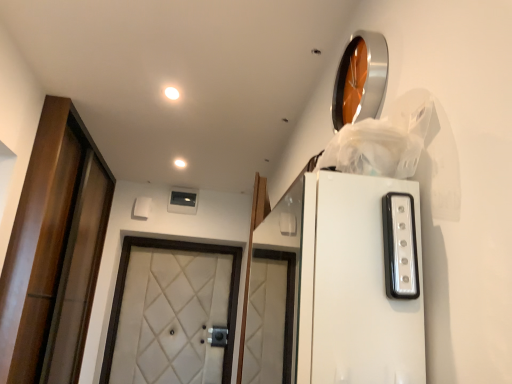
What do you see at coordinates (54, 250) in the screenshot? This screenshot has width=512, height=384. I see `brown wooden door at left, which ranks as the second door in right-to-left order` at bounding box center [54, 250].

What is the approximate width of brown wooden door at left, which ranks as the second door in right-to-left order?

brown wooden door at left, which ranks as the second door in right-to-left order, is 4.55 inches in width.

What do you see at coordinates (180, 163) in the screenshot?
I see `white matte light fixture at upper center, positioned as the second lighting in top-to-bottom order` at bounding box center [180, 163].

At what (x,y) coordinates should I click in order to perform the action: click on white glossy light strip at upper right. Please return your answer as a coordinate pair (x, y). Looking at the image, I should click on (400, 246).

Locate an element on the screen. brown wooden door at left, marked as the 1th door in a left-to-right arrangement is located at coordinates (54, 250).

Between matte white light fixture at upper center, which is the 1th lighting from front to back, and white glossy light strip at upper right, which one appears on the right side from the viewer's perspective?

white glossy light strip at upper right is more to the right.

Which is more distant, (169,92) or (408,278)?

Point (169,92)

Which is behind, matte white light fixture at upper center, the second lighting when ordered from bottom to top, or white glossy light strip at upper right?

matte white light fixture at upper center, the second lighting when ordered from bottom to top, is more distant.

Is white quilted fabric door at center, acting as the second door starting from the left, shorter than matte white light fixture at upper center, marked as the 1th lighting in a right-to-left arrangement?

Incorrect, the height of white quilted fabric door at center, acting as the second door starting from the left, does not fall short of that of matte white light fixture at upper center, marked as the 1th lighting in a right-to-left arrangement.

Can you confirm if white quilted fabric door at center, the first door when ordered from right to left, is positioned to the left of matte white light fixture at upper center, which is the 1th lighting from front to back?

Yes, white quilted fabric door at center, the first door when ordered from right to left, is to the left of matte white light fixture at upper center, which is the 1th lighting from front to back.

Considering the points (231, 310) and (169, 93), which point is in front, point (231, 310) or point (169, 93)?

The point (169, 93) is closer to the camera.

Considering the relative positions of brown wooden door at left, which ranks as the second door in right-to-left order, and white quilted fabric door at center, the first door when ordered from right to left, in the image provided, is brown wooden door at left, which ranks as the second door in right-to-left order, to the right of white quilted fabric door at center, the first door when ordered from right to left, from the viewer's perspective?

Incorrect, brown wooden door at left, which ranks as the second door in right-to-left order, is not on the right side of white quilted fabric door at center, the first door when ordered from right to left.

Which is closer to the camera, (89, 214) or (127, 241)?

The point (89, 214) is in front.

Is the surface of brown wooden door at left, which ranks as the second door in right-to-left order, in direct contact with white quilted fabric door at center, the first door when ordered from right to left?

No, brown wooden door at left, which ranks as the second door in right-to-left order, is not making contact with white quilted fabric door at center, the first door when ordered from right to left.

Can you confirm if brown wooden door at left, marked as the 1th door in a left-to-right arrangement, is bigger than white quilted fabric door at center, the first door when ordered from right to left?

Yes.

Would you say white matte light fixture at upper center, marked as the second lighting in a front-to-back arrangement, contains white glossy light strip at upper right?

No, white glossy light strip at upper right is not surrounded by white matte light fixture at upper center, marked as the second lighting in a front-to-back arrangement.

Measure the distance between white matte light fixture at upper center, the 1th lighting positioned from the bottom, and white glossy light strip at upper right.

A distance of 1.90 meters exists between white matte light fixture at upper center, the 1th lighting positioned from the bottom, and white glossy light strip at upper right.

Between point (181, 161) and point (386, 198), which one is positioned behind?

Point (181, 161)

Could you measure the distance between matte white light fixture at upper center, marked as the 1th lighting in a right-to-left arrangement, and white quilted fabric door at center, the first door when ordered from right to left?

The distance of matte white light fixture at upper center, marked as the 1th lighting in a right-to-left arrangement, from white quilted fabric door at center, the first door when ordered from right to left, is 5.34 feet.

This screenshot has width=512, height=384. What are the coordinates of `the 2nd lighting above when counting from the white quilted fabric door at center, the first door when ordered from right to left (from the image's perspective)` in the screenshot? It's located at (172, 93).

Looking at this image, which is behind, matte white light fixture at upper center, which appears as the second lighting when viewed from the left, or white quilted fabric door at center, the first door when ordered from right to left?

white quilted fabric door at center, the first door when ordered from right to left.

Visually, is matte white light fixture at upper center, acting as the first lighting starting from the top, positioned to the left or to the right of white quilted fabric door at center, acting as the second door starting from the left?

Based on their positions, matte white light fixture at upper center, acting as the first lighting starting from the top, is located to the right of white quilted fabric door at center, acting as the second door starting from the left.

Where is `the 2nd door directly beneath the white matte light fixture at upper center, positioned as the second lighting in top-to-bottom order (from a real-world perspective)`? The height and width of the screenshot is (384, 512). the 2nd door directly beneath the white matte light fixture at upper center, positioned as the second lighting in top-to-bottom order (from a real-world perspective) is located at coordinates (170, 249).

Is white matte light fixture at upper center, the first lighting from the back, facing towards white quilted fabric door at center, acting as the second door starting from the left?

No, white matte light fixture at upper center, the first lighting from the back, does not turn towards white quilted fabric door at center, acting as the second door starting from the left.

Looking at this image, which is more to the right, white matte light fixture at upper center, the 1th lighting positioned from the bottom, or white quilted fabric door at center, acting as the second door starting from the left?

Positioned to the right is white matte light fixture at upper center, the 1th lighting positioned from the bottom.

Considering the relative sizes of white matte light fixture at upper center, positioned as the second lighting in top-to-bottom order, and white quilted fabric door at center, the first door when ordered from right to left, in the image provided, is white matte light fixture at upper center, positioned as the second lighting in top-to-bottom order, wider than white quilted fabric door at center, the first door when ordered from right to left,?

No.

Would you say white glossy light strip at upper right is part of brown wooden door at left, which ranks as the second door in right-to-left order,'s contents?

No.

Is brown wooden door at left, marked as the 1th door in a left-to-right arrangement, oriented towards white glossy light strip at upper right?

No, brown wooden door at left, marked as the 1th door in a left-to-right arrangement, is not turned towards white glossy light strip at upper right.

Considering the positions of point (31, 362) and point (388, 263), is point (31, 362) closer or farther from the camera than point (388, 263)?

Point (31, 362) is farther from the camera than point (388, 263).

Based on the photo, considering the relative sizes of brown wooden door at left, which ranks as the second door in right-to-left order, and white glossy light strip at upper right in the image provided, is brown wooden door at left, which ranks as the second door in right-to-left order, bigger than white glossy light strip at upper right?

Indeed, brown wooden door at left, which ranks as the second door in right-to-left order, has a larger size compared to white glossy light strip at upper right.

The width and height of the screenshot is (512, 384). Find the location of `appliance in front of the matte white light fixture at upper center, the 2th lighting viewed from the back`. appliance in front of the matte white light fixture at upper center, the 2th lighting viewed from the back is located at coordinates (400, 246).

From the image's perspective, which door is the 2nd one below the matte white light fixture at upper center, the 2th lighting viewed from the back? Please provide its 2D coordinates.

[(170, 249)]

Which object lies further to the anchor point white glossy light strip at upper right, white matte light fixture at upper center, which is the 1th lighting from left to right, or white quilted fabric door at center, acting as the second door starting from the left?

Among the two, white quilted fabric door at center, acting as the second door starting from the left, is located further to white glossy light strip at upper right.

Estimate the real-world distances between objects in this image. Which object is closer to white glossy light strip at upper right, white matte light fixture at upper center, acting as the 2th lighting starting from the right, or matte white light fixture at upper center, which is the 1th lighting from front to back?

The object closer to white glossy light strip at upper right is matte white light fixture at upper center, which is the 1th lighting from front to back.

From the image, which object appears to be farther from white glossy light strip at upper right, matte white light fixture at upper center, the second lighting when ordered from bottom to top, or brown wooden door at left, marked as the 1th door in a left-to-right arrangement?

The object further to white glossy light strip at upper right is brown wooden door at left, marked as the 1th door in a left-to-right arrangement.

Which object lies further to the anchor point matte white light fixture at upper center, acting as the first lighting starting from the top, white quilted fabric door at center, the first door when ordered from right to left, or white matte light fixture at upper center, the first lighting from the back?

white quilted fabric door at center, the first door when ordered from right to left, is positioned further to the anchor matte white light fixture at upper center, acting as the first lighting starting from the top.

From the picture: Looking at the image, which one is located closer to brown wooden door at left, which ranks as the second door in right-to-left order, matte white light fixture at upper center, acting as the first lighting starting from the top, or white glossy light strip at upper right?

The object closer to brown wooden door at left, which ranks as the second door in right-to-left order, is matte white light fixture at upper center, acting as the first lighting starting from the top.

From the picture: When comparing their distances from white glossy light strip at upper right, does white quilted fabric door at center, acting as the second door starting from the left, or brown wooden door at left, marked as the 1th door in a left-to-right arrangement, seem further?

white quilted fabric door at center, acting as the second door starting from the left.

Estimate the real-world distances between objects in this image. Which object is further from white quilted fabric door at center, acting as the second door starting from the left, brown wooden door at left, which ranks as the second door in right-to-left order, or matte white light fixture at upper center, which is the 1th lighting from front to back?

matte white light fixture at upper center, which is the 1th lighting from front to back.

From the image, which object appears to be farther from white matte light fixture at upper center, marked as the second lighting in a front-to-back arrangement, brown wooden door at left, marked as the 1th door in a left-to-right arrangement, or matte white light fixture at upper center, acting as the first lighting starting from the top?

brown wooden door at left, marked as the 1th door in a left-to-right arrangement, is positioned further to the anchor white matte light fixture at upper center, marked as the second lighting in a front-to-back arrangement.

Where is `lighting between brown wooden door at left, marked as the 1th door in a left-to-right arrangement, and white matte light fixture at upper center, marked as the second lighting in a front-to-back arrangement, from front to back`? Image resolution: width=512 pixels, height=384 pixels. lighting between brown wooden door at left, marked as the 1th door in a left-to-right arrangement, and white matte light fixture at upper center, marked as the second lighting in a front-to-back arrangement, from front to back is located at coordinates (172, 93).

This screenshot has height=384, width=512. Find the location of `lighting between white glossy light strip at upper right and white matte light fixture at upper center, positioned as the second lighting in top-to-bottom order, in the front-back direction`. lighting between white glossy light strip at upper right and white matte light fixture at upper center, positioned as the second lighting in top-to-bottom order, in the front-back direction is located at coordinates (172, 93).

In order to click on door positioned between white glossy light strip at upper right and white matte light fixture at upper center, acting as the 2th lighting starting from the right, from near to far in this screenshot , I will do `click(54, 250)`.

The image size is (512, 384). I want to click on lighting between matte white light fixture at upper center, which is the 1th lighting from front to back, and white quilted fabric door at center, acting as the second door starting from the left, vertically, so click(180, 163).